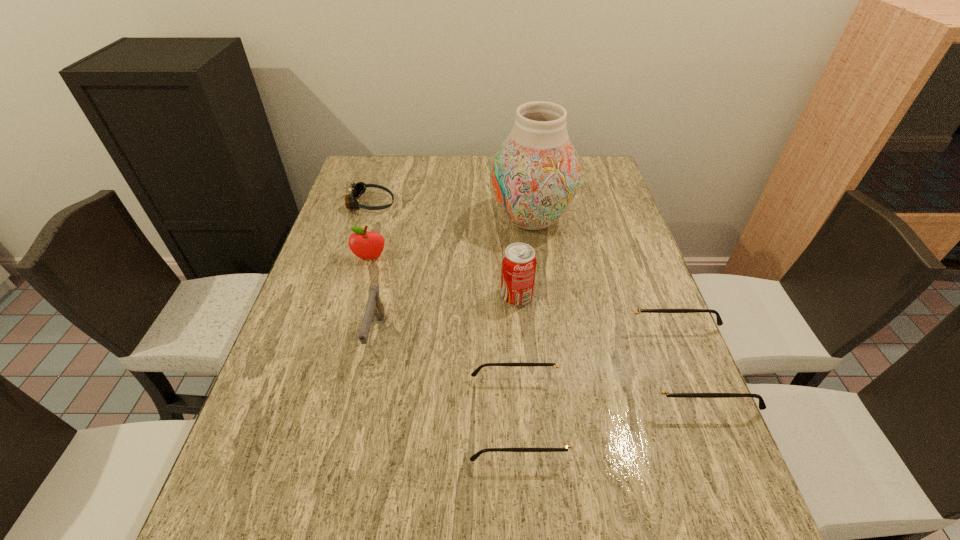
Please point a spot on the left to add another spectacles. Please provide its 2D coordinates. Your answer should be formatted as a tuple, i.e. [(x, y)], where the tuple contains the x and y coordinates of a point satisfying the conditions above.

[(312, 480)]